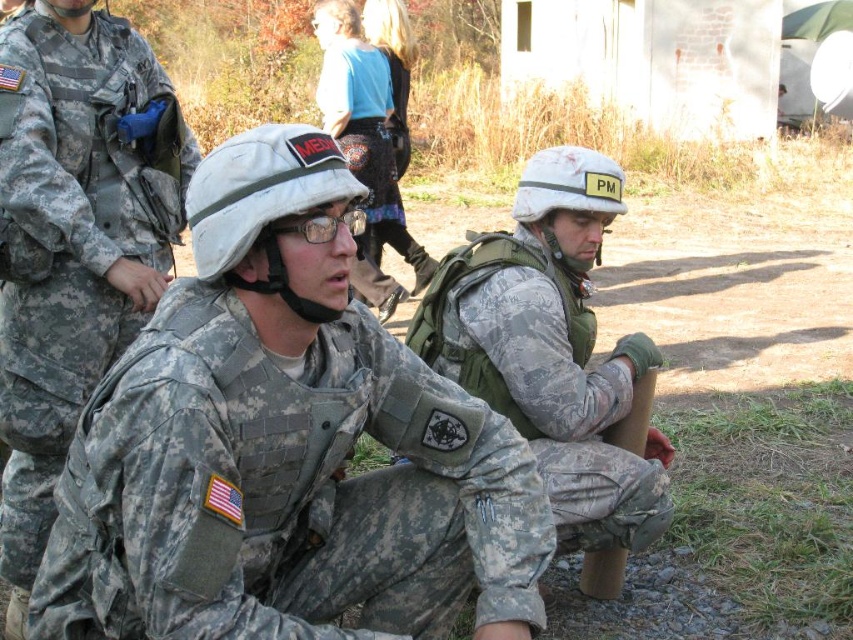
You are a military medic observing the scene. You notice the camouflage fabric uniform at center and the camouflage fabric helmet at center. Which object is located lower in the image?

The camouflage fabric uniform at center is positioned under the camouflage fabric helmet at center, so the uniform is lower.

You are a photographer trying to capture a clear shot of the blue denim skirt at center and the brushed metal backpack at center. Since you want to focus on the larger object, which one should you adjust your camera settings for?

The blue denim skirt at center is bigger than the brushed metal backpack at center, so you should adjust your camera settings to focus on the blue denim skirt at center.

You are part of a military unit and need to access your equipment. You see a blue denim skirt at center and a brushed metal backpack at center. Which item is blocking the other?

The blue denim skirt at center is positioned over the brushed metal backpack at center, so the skirt is blocking the backpack.